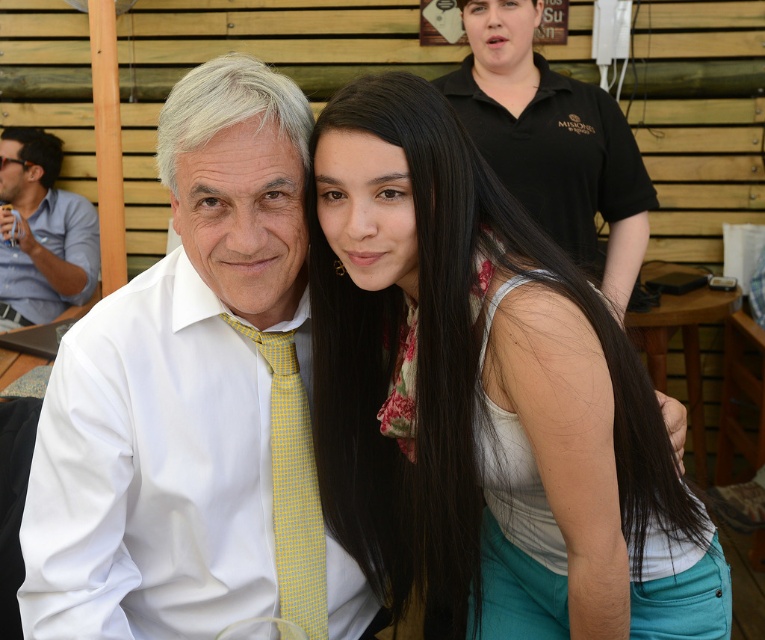
Based on the scene description, where is the white fabric top at center located in the image?

The white fabric top at center is located at point coordinates of 0.622 on the x axis and 0.637 on the y axis.

You are a photographer trying to capture a candid shot of the two people in the image. You want to ensure that both the white fabric top at center and the yellow checkered tie at center are clearly visible in the frame. Based on their positions, which item is positioned higher up in the image?

The white fabric top at center is located above the yellow checkered tie at center, so it is positioned higher up in the image.

You are standing at the origin point in the image and want to reach the point labeled as point (658, 452). However, there is an obstacle at point (290, 323). Based on the spatial relationship between these two points, will you encounter the obstacle before reaching your destination?

Yes, you will encounter the obstacle at point (290, 323) before reaching point (658, 452) because point (658, 452) is in front of point (290, 323), meaning the obstacle is closer to your starting position.